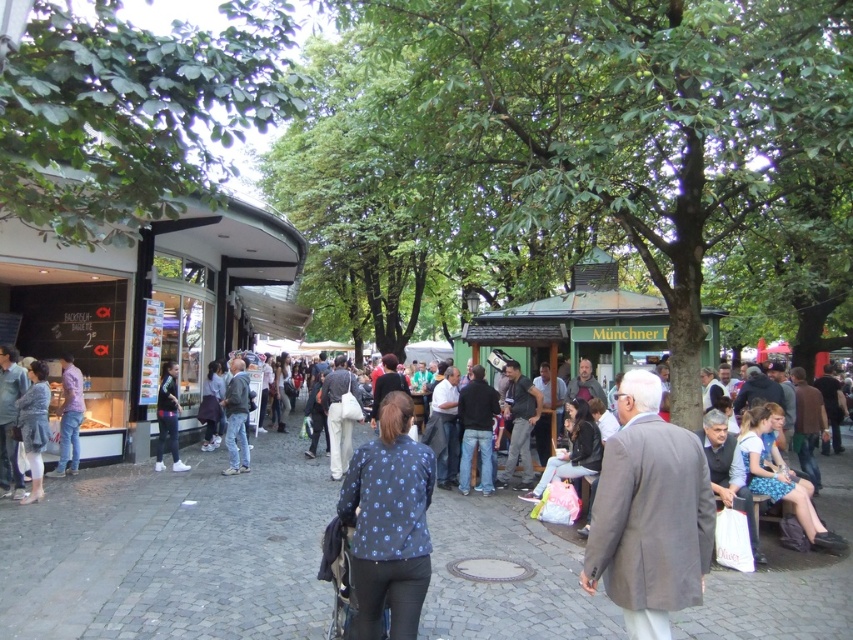
How much distance is there between paved stone pavement at center and blue denim dress at lower right?

6.44 feet

Between point (47, 620) and point (761, 412), which one is positioned in front?

Point (47, 620)

Which is in front, point (556, 573) or point (805, 509)?

Point (556, 573) is in front.

Find the location of a particular element. This screenshot has height=640, width=853. paved stone pavement at center is located at coordinates (171, 552).

Which of these two, paved stone pavement at center or denim jeans at center, stands taller?

Standing taller between the two is denim jeans at center.

Find the location of a particular element. Image resolution: width=853 pixels, height=640 pixels. paved stone pavement at center is located at coordinates (171, 552).

At what (x,y) coordinates should I click in order to perform the action: click on paved stone pavement at center. Please return your answer as a coordinate pair (x, y). The image size is (853, 640). Looking at the image, I should click on (171, 552).

Between point (146, 486) and point (167, 378), which one is positioned in front?

Point (146, 486)

Can you confirm if paved stone pavement at center is smaller than dark blue jeans at left?

No.

Who is more forward, (299, 592) or (165, 372)?

Positioned in front is point (299, 592).

Image resolution: width=853 pixels, height=640 pixels. Identify the location of paved stone pavement at center. (171, 552).